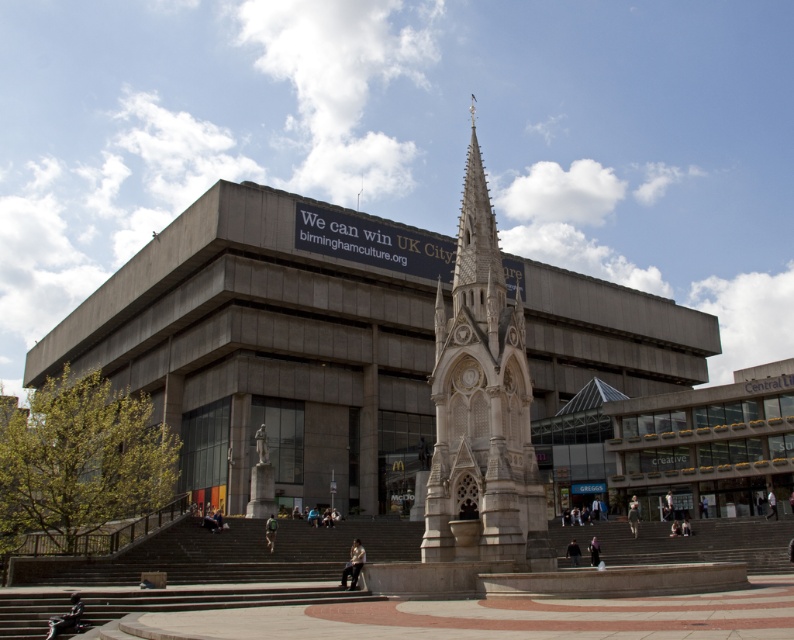
Measure the distance between point (x=700, y=534) and camera.

Point (x=700, y=534) and camera are 66.37 meters apart from each other.

Is point (2, 621) behind point (274, 538)?

No, (2, 621) is in front of (274, 538).

This screenshot has width=794, height=640. I want to click on concrete stairs at center, so click(x=210, y=572).

Is point (634, 509) closer to camera compared to point (571, 552)?

No, it is behind (571, 552).

Identify the location of dark gray fabric jacket at lower center. The height and width of the screenshot is (640, 794). (633, 515).

Is point (629, 525) behind point (577, 554)?

Yes.

At what (x,y) coordinates should I click in order to perform the action: click on dark gray fabric jacket at lower center. Please return your answer as a coordinate pair (x, y). This screenshot has width=794, height=640. Looking at the image, I should click on (633, 515).

Who is higher up, white stone tower at center or light brown leather jacket at center?

white stone tower at center

How much distance is there between white stone tower at center and light brown leather jacket at center?

white stone tower at center is 16.01 meters from light brown leather jacket at center.

Who is more forward, (465, 451) or (363, 552)?

Point (363, 552) is more forward.

Identify the location of white stone tower at center. (482, 406).